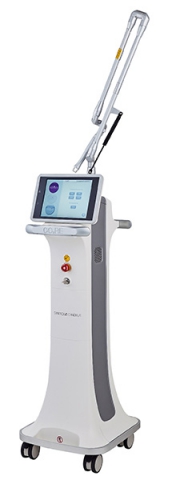
Locate an element on the screen. The width and height of the screenshot is (176, 480). handle is located at coordinates [x=61, y=230], [x=127, y=226].